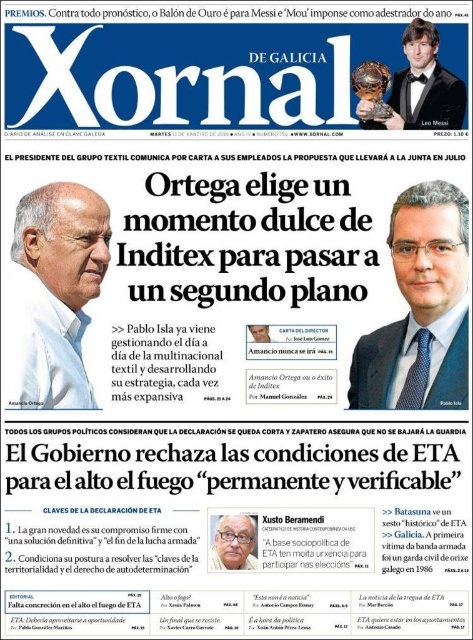
Question: Is black tuxedo at upper right wider than gray hair at center?

Choices:
 (A) no
 (B) yes

Answer: (A)

Question: Can you confirm if matte black suit at right is thinner than gray hair at center?

Choices:
 (A) yes
 (B) no

Answer: (B)

Question: Which object is closer to the camera taking this photo?

Choices:
 (A) white matte face at upper left
 (B) black tuxedo at upper right
 (C) matte black suit at right
 (D) gray hair at center

Answer: (A)

Question: Estimate the real-world distances between objects in this image. Which object is farther from the matte black suit at right?

Choices:
 (A) white matte face at upper left
 (B) gray hair at center
 (C) black tuxedo at upper right

Answer: (A)

Question: Is black tuxedo at upper right bigger than gray hair at center?

Choices:
 (A) yes
 (B) no

Answer: (B)

Question: Which point appears farthest from the camera in this image?

Choices:
 (A) (437, 32)
 (B) (32, 292)

Answer: (A)